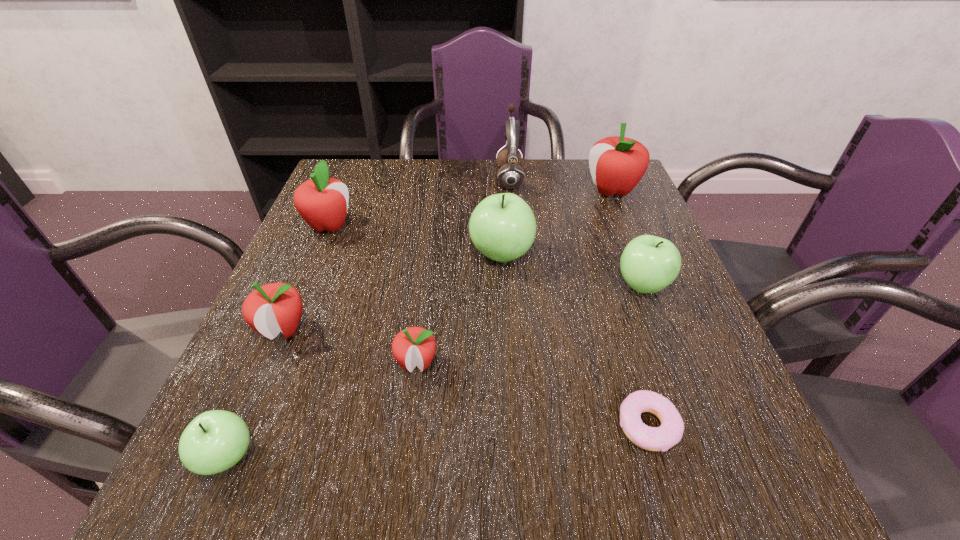
Locate an element on the screen. The width and height of the screenshot is (960, 540). the leftmost green apple is located at coordinates (214, 441).

Locate an element on the screen. The height and width of the screenshot is (540, 960). the smallest green apple is located at coordinates (214, 441).

What are the coordinates of `the shortest object` in the screenshot? It's located at (669, 433).

Locate an element on the screen. The height and width of the screenshot is (540, 960). pink doughnut is located at coordinates (669, 433).

At what (x,y) coordinates should I click in order to perform the action: click on vacant region located on the ear pads of the brown earphone. Please return your answer as a coordinate pair (x, y). Looking at the image, I should click on (464, 179).

Locate an element on the screen. vacant space situated on the ear pads of the brown earphone is located at coordinates (453, 179).

Locate an element on the screen. The height and width of the screenshot is (540, 960). free space located 0.230m on the ear pads of the brown earphone is located at coordinates (413, 179).

You are a GUI agent. You are given a task and a screenshot of the screen. Output one action in this format:
    pyautogui.click(x=<x>, y=<y>)
    Task: Click on the free space located 0.240m on the left of the rightmost red apple
    The width and height of the screenshot is (960, 540).
    Given the screenshot: What is the action you would take?
    pyautogui.click(x=495, y=191)

You are a GUI agent. You are given a task and a screenshot of the screen. Output one action in this format:
    pyautogui.click(x=<x>, y=<y>)
    Task: Click on the vacant point located on the right of the second biggest red apple
    
    Given the screenshot: What is the action you would take?
    pyautogui.click(x=492, y=226)

Identify the location of vacant region located on the back of the second green apple from right to left. (499, 222).